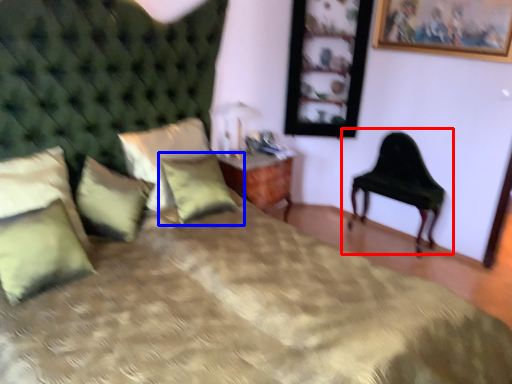
Question: Which object is further to the camera taking this photo, chair (highlighted by a red box) or pillow (highlighted by a blue box)?

Choices:
 (A) chair
 (B) pillow

Answer: (A)